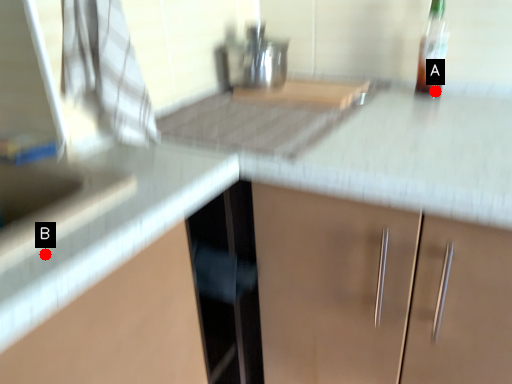
Question: Two points are circled on the image, labeled by A and B beside each circle. Which point is further to the camera?

Choices:
 (A) A is further
 (B) B is further

Answer: (A)